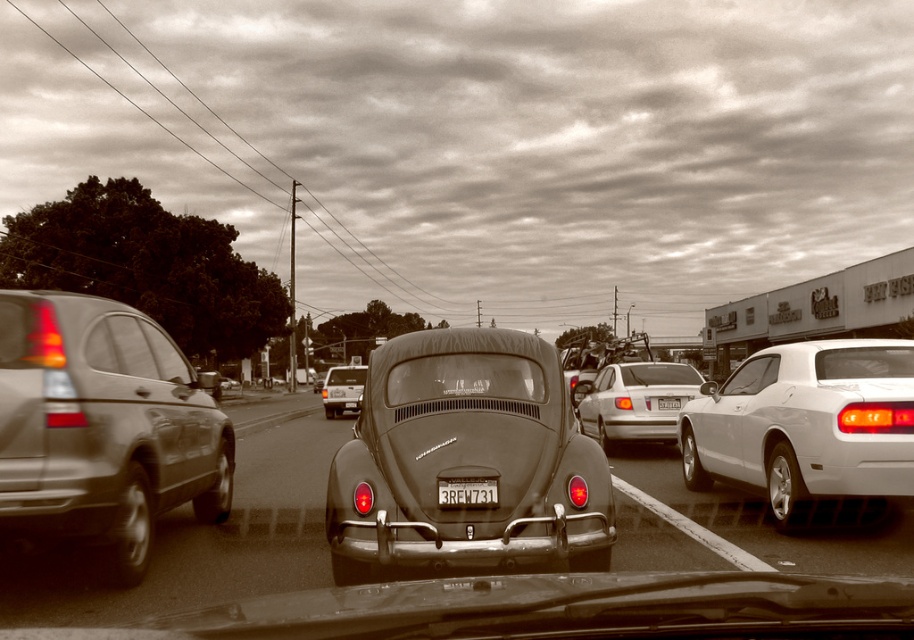
Does matte black car at center have a larger size compared to metallic silver sedan at center?

Actually, matte black car at center might be smaller than metallic silver sedan at center.

You are a GUI agent. You are given a task and a screenshot of the screen. Output one action in this format:
    pyautogui.click(x=<x>, y=<y>)
    Task: Click on the matte black car at center
    This screenshot has width=914, height=640.
    Given the screenshot: What is the action you would take?
    466,460

Which is in front, point (430, 387) or point (604, 412)?

Point (430, 387) is in front.

Where is `matte black car at center`? The height and width of the screenshot is (640, 914). matte black car at center is located at coordinates (466, 460).

Between white glossy car at right and clear glass windshield at center, which one has less height?

clear glass windshield at center is shorter.

Is white glossy car at right to the right of clear glass windshield at center from the viewer's perspective?

Correct, you'll find white glossy car at right to the right of clear glass windshield at center.

Measure the distance between point (875, 356) and camera.

Point (875, 356) and camera are 7.24 meters apart.

Where is `white glossy car at right`? Image resolution: width=914 pixels, height=640 pixels. white glossy car at right is located at coordinates (806, 424).

Between white glossy car at right and metallic silver sedan at center, which one appears on the left side from the viewer's perspective?

metallic silver sedan at center

Who is higher up, white glossy car at right or metallic silver sedan at center?

Positioned higher is white glossy car at right.

Which is in front, point (774, 362) or point (626, 364)?

Point (774, 362) is more forward.

Where is `white glossy car at right`? white glossy car at right is located at coordinates (806, 424).